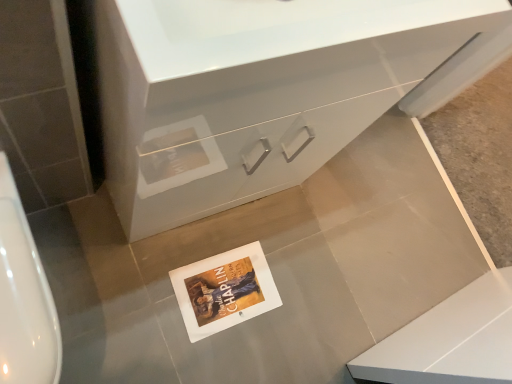
Question: From a real-world perspective, is white glossy cabinet at center below white paper postcard at center?

Choices:
 (A) yes
 (B) no

Answer: (B)

Question: Would you say white paper postcard at center is part of white glossy cabinet at center's contents?

Choices:
 (A) yes
 (B) no

Answer: (B)

Question: Can you confirm if white glossy cabinet at center is taller than white paper postcard at center?

Choices:
 (A) no
 (B) yes

Answer: (B)

Question: Does white glossy cabinet at center appear on the left side of white paper postcard at center?

Choices:
 (A) yes
 (B) no

Answer: (B)

Question: Is white glossy cabinet at center with white paper postcard at center?

Choices:
 (A) yes
 (B) no

Answer: (B)

Question: Considering the relative positions of white glossy cabinet at center and white paper postcard at center in the image provided, is white glossy cabinet at center in front of white paper postcard at center?

Choices:
 (A) no
 (B) yes

Answer: (B)

Question: Is white glossy urinal at left completely or partially inside white paper postcard at center?

Choices:
 (A) yes
 (B) no

Answer: (B)

Question: Is white paper postcard at center aimed at white glossy urinal at left?

Choices:
 (A) yes
 (B) no

Answer: (B)

Question: Can you confirm if white paper postcard at center is wider than white glossy urinal at left?

Choices:
 (A) yes
 (B) no

Answer: (B)

Question: Is there a large distance between white paper postcard at center and white glossy urinal at left?

Choices:
 (A) no
 (B) yes

Answer: (A)

Question: Does white paper postcard at center have a greater height compared to white glossy urinal at left?

Choices:
 (A) no
 (B) yes

Answer: (A)

Question: From a real-world perspective, is white paper postcard at center on top of white glossy urinal at left?

Choices:
 (A) no
 (B) yes

Answer: (A)

Question: Would you say white glossy urinal at left is outside white paper postcard at center?

Choices:
 (A) no
 (B) yes

Answer: (B)